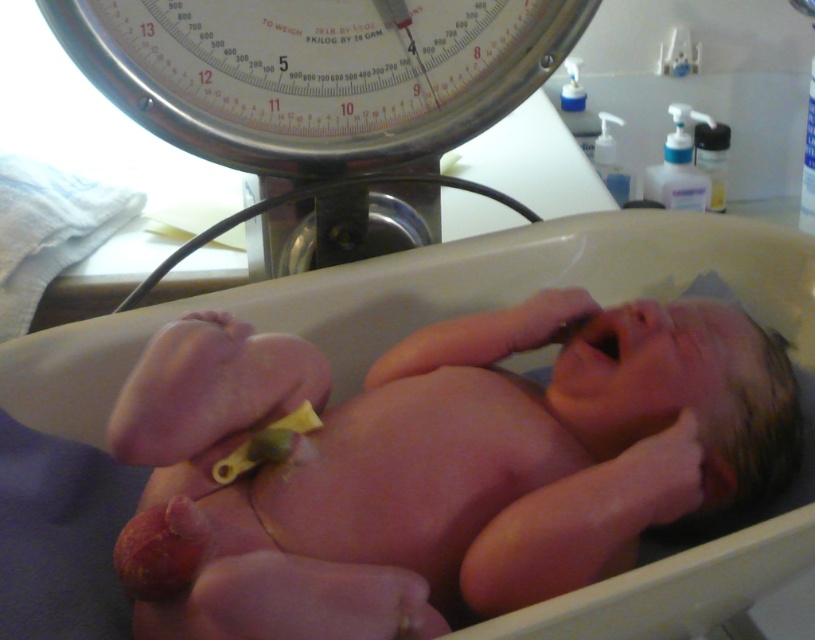
You are a nurse in a hospital nursery. You need to check the baby in the bassinet. Where is the pink smooth skin at center located in the image?

The pink smooth skin at center is located at point (454, 451) in the image.

You are a nurse in a hospital. You need to weigh the newborn baby whose pink smooth skin at center is currently lying in the bassinet. The metallic scale at upper center is available. Can you reach the baby to place it on the scale without moving the bassinet?

The distance between the pink smooth skin at center and the metallic scale at upper center is 34.66 centimeters. Since the scale is within a reasonable reach, the nurse can likely reach the baby to place it on the scale without needing to move the bassinet.